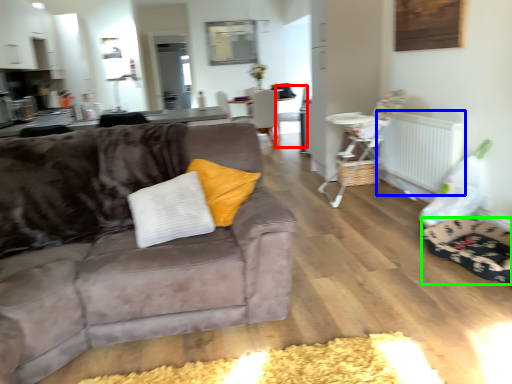
Question: Considering the real-world distances, which object is closest to armchair (highlighted by a red box)? radiator (highlighted by a blue box) or dog bed (highlighted by a green box).

Choices:
 (A) radiator
 (B) dog bed

Answer: (A)